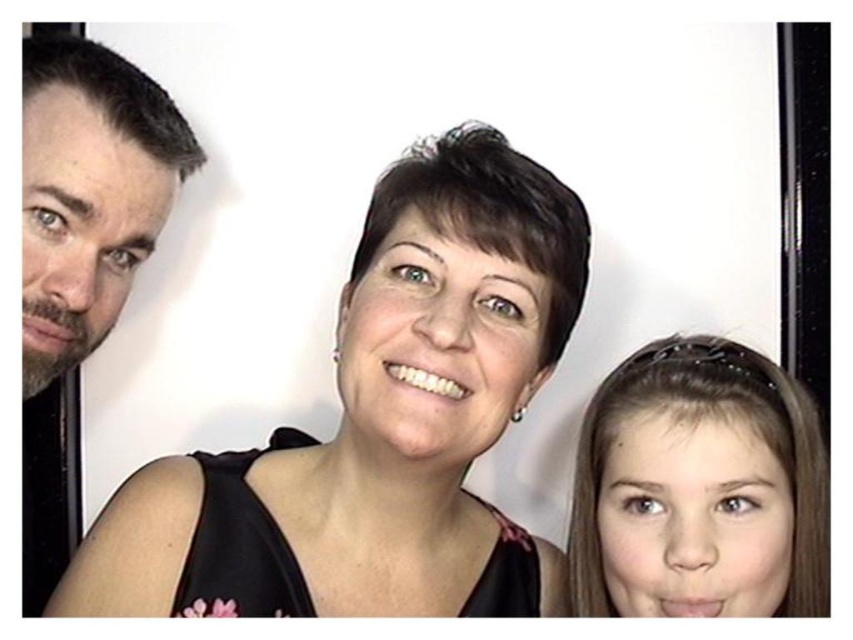
Question: Does smooth brown hair at lower right have a larger size compared to dark brown hair at left?

Choices:
 (A) yes
 (B) no

Answer: (A)

Question: Which of the following is the farthest from the observer?

Choices:
 (A) (456, 348)
 (B) (619, 454)

Answer: (B)

Question: Can you confirm if smooth brown hair at lower right is thinner than dark brown hair at left?

Choices:
 (A) no
 (B) yes

Answer: (A)

Question: Which point is farther to the camera?

Choices:
 (A) dark brown hair at left
 (B) black fabric at center

Answer: (A)

Question: Among these objects, which one is nearest to the camera?

Choices:
 (A) black fabric at center
 (B) dark brown hair at left
 (C) smooth brown hair at lower right

Answer: (A)

Question: Does smooth brown hair at lower right come in front of dark brown hair at left?

Choices:
 (A) no
 (B) yes

Answer: (A)